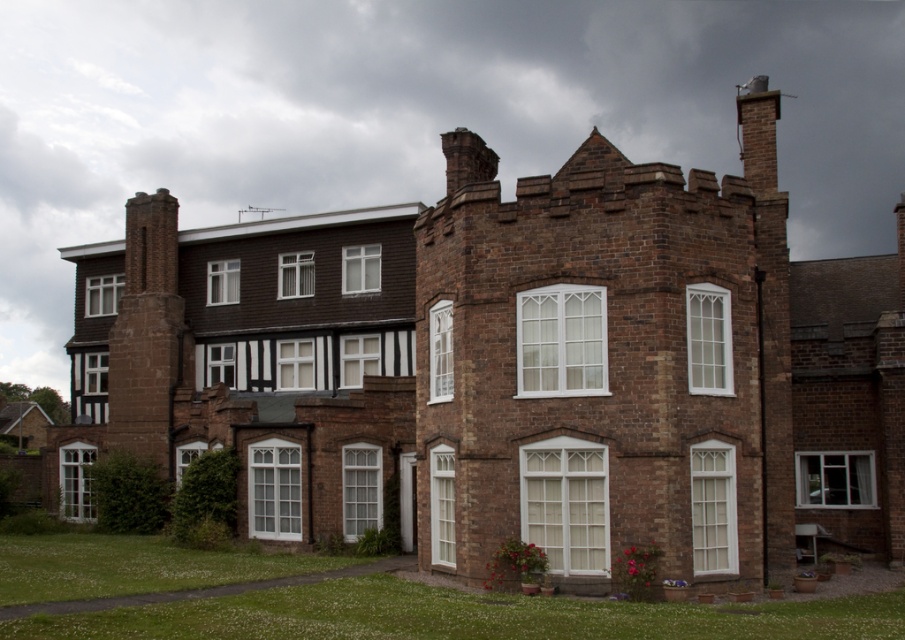
Can you confirm if brown brick chimney at upper right is positioned to the right of brown stone chimney at left?

Indeed, brown brick chimney at upper right is positioned on the right side of brown stone chimney at left.

Measure the distance between brown brick chimney at upper right and camera.

brown brick chimney at upper right is 33.33 meters away from camera.

The image size is (905, 640). What are the coordinates of `brown brick chimney at upper right` in the screenshot? It's located at (606, 362).